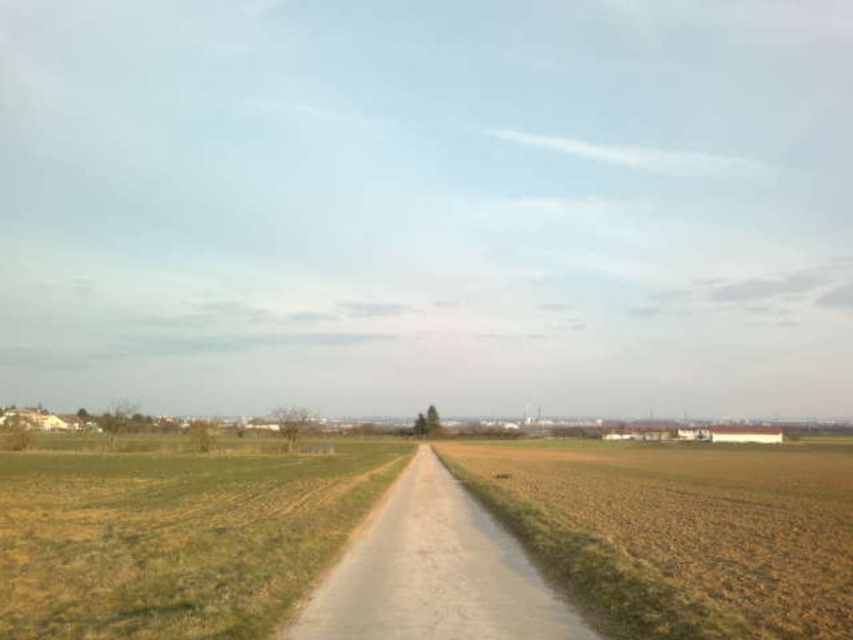
Question: Observing the image, what is the correct spatial positioning of brown soil field at lower right in reference to dull gray gravel road at center?

Choices:
 (A) above
 (B) below

Answer: (B)

Question: Can you confirm if green grass at lower left is positioned to the right of dull gray gravel road at center?

Choices:
 (A) yes
 (B) no

Answer: (B)

Question: Can you confirm if brown soil field at lower right is smaller than dull gray gravel road at center?

Choices:
 (A) no
 (B) yes

Answer: (A)

Question: Which of the following is the farthest from the observer?

Choices:
 (A) brown soil field at lower right
 (B) green grass at lower left
 (C) dull gray gravel road at center

Answer: (B)

Question: Among these objects, which one is nearest to the camera?

Choices:
 (A) green grass at lower left
 (B) dull gray gravel road at center

Answer: (B)

Question: Which point appears farthest from the camera in this image?

Choices:
 (A) (239, 625)
 (B) (355, 586)

Answer: (B)